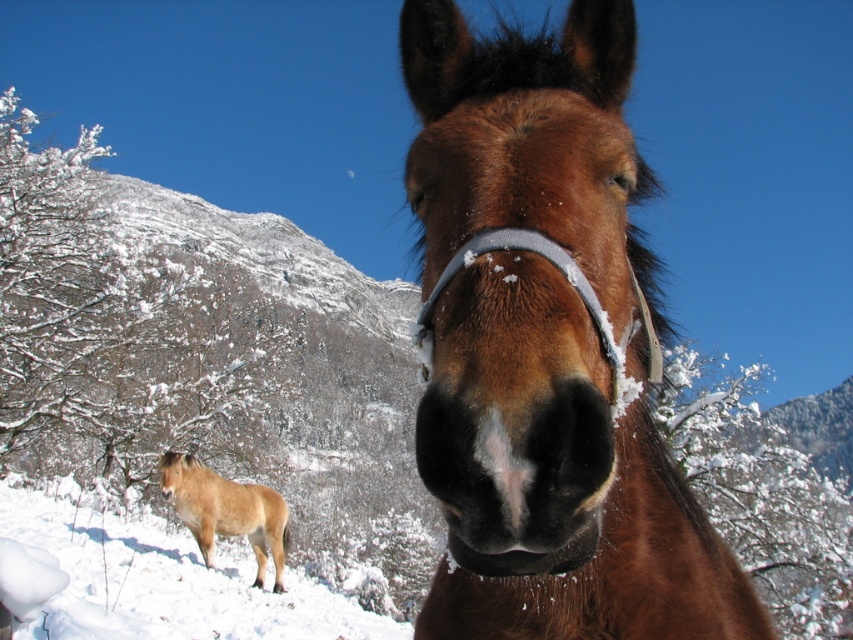
In the scene shown: You are a photographer trying to capture both the brown glossy horse at center and the light brown fur pony at lower left in a single frame. Based on their positions, which horse should you focus on first to ensure both are in the frame?

The brown glossy horse at center is located above the light brown fur pony at lower left, so you should focus on the light brown fur pony at lower left first to ensure both are in the frame.

You are a photographer trying to capture both the brown glossy horse at center and the light brown fur pony at lower left in a single frame. Which horse should you position closer to the camera to ensure both fit in the frame without cropping?

You should position the light brown fur pony at lower left closer to the camera because the brown glossy horse at center is wider than the light brown fur pony at lower left, so bringing the smaller pony forward will help balance their sizes in the frame.

You are a photographer trying to capture a photo of both the brown glossy horse at center and the light brown fur pony at lower left. From your current position, which horse is positioned to your right?

The brown glossy horse at center is to the right of the light brown fur pony at lower left, so the brown glossy horse at center would be on your right side when facing the scene.